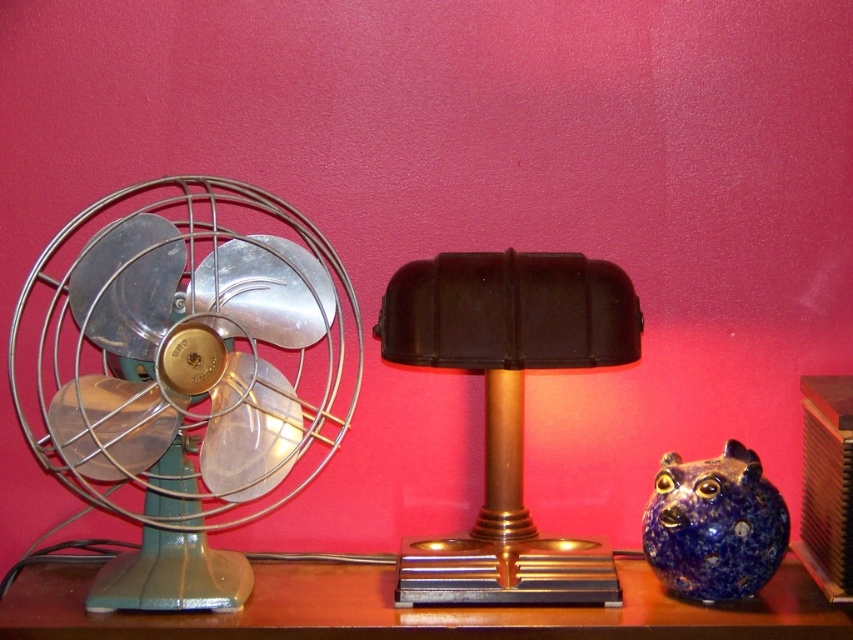
Question: Which point appears farthest from the camera in this image?

Choices:
 (A) (683, 524)
 (B) (403, 358)
 (C) (283, 381)

Answer: (C)

Question: Can you confirm if metallic silver fan at left is smaller than black plastic table lamp at center?

Choices:
 (A) yes
 (B) no

Answer: (B)

Question: Is the position of black plastic table lamp at center less distant than that of blue speckled ceramic piggy bank at lower right?

Choices:
 (A) no
 (B) yes

Answer: (B)

Question: Which object is the farthest from the metallic brown table at center?

Choices:
 (A) metallic silver fan at left
 (B) blue speckled ceramic piggy bank at lower right

Answer: (A)

Question: Which point is farther from the camera taking this photo?

Choices:
 (A) (762, 557)
 (B) (273, 248)
 (C) (555, 598)
 (D) (84, 564)

Answer: (D)

Question: From the image, what is the correct spatial relationship of metallic silver fan at left in relation to black plastic table lamp at center?

Choices:
 (A) below
 (B) above

Answer: (B)